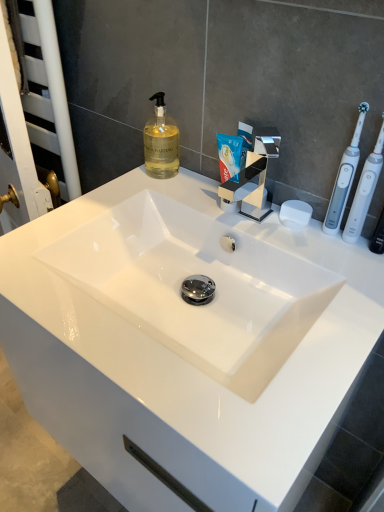
This screenshot has width=384, height=512. In order to click on blank space to the left of white plastic toothbrush at right, the 2th toothbrush in the right-to-left sequence in this screenshot , I will do `click(257, 222)`.